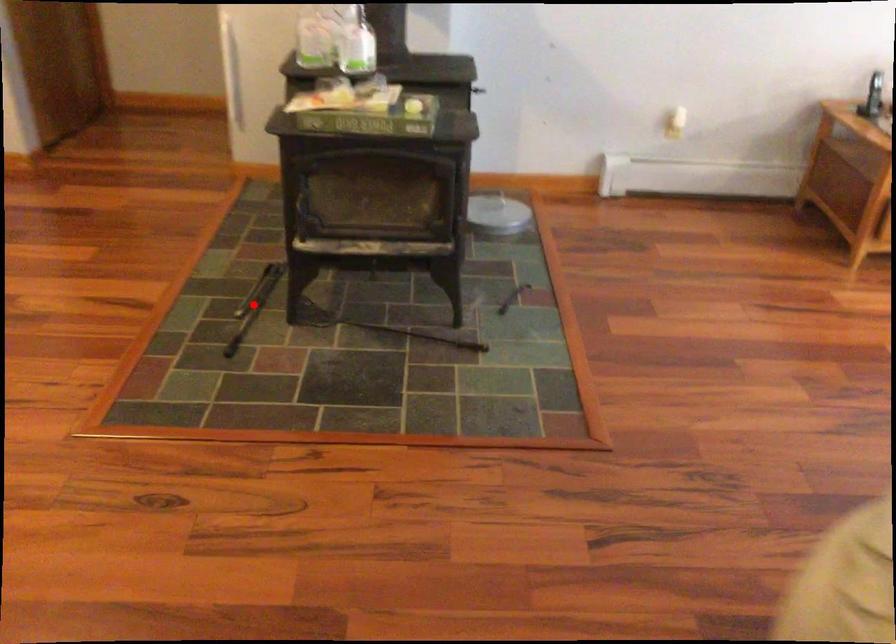
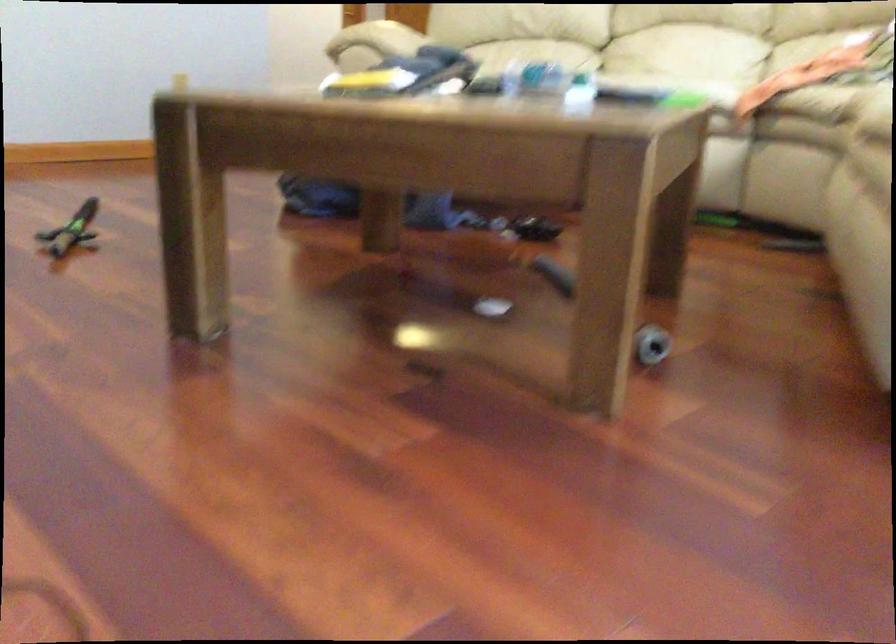
Question: I am providing you with two images of the same scene from different viewpoints. A red point is marked on the first image. At the location where the point appears in image 1, is it still visible in image 2?

Choices:
 (A) Yes
 (B) No

Answer: (B)